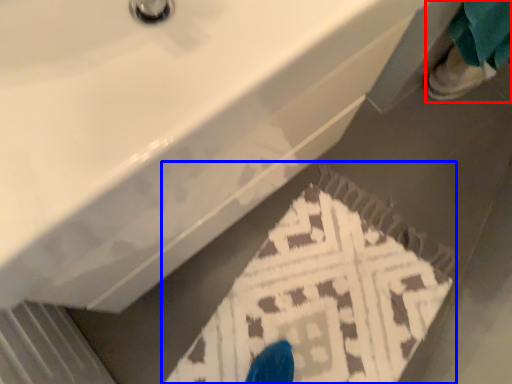
Question: Which point is closer to the camera, person (highlighted by a red box) or doormat (highlighted by a blue box)?

Choices:
 (A) person
 (B) doormat

Answer: (B)